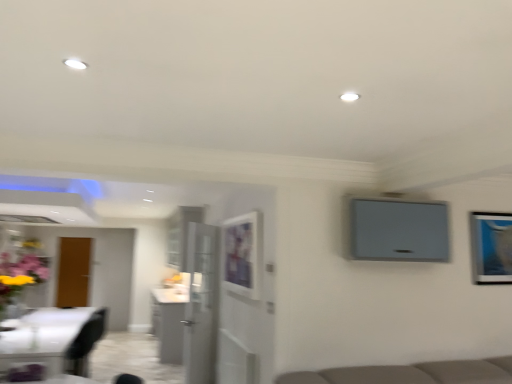
Question: Considering the relative sizes of matte purple vase at left and matte white picture frame at center, acting as the first picture frame starting from the left, in the image provided, is matte purple vase at left shorter than matte white picture frame at center, acting as the first picture frame starting from the left,?

Choices:
 (A) yes
 (B) no

Answer: (A)

Question: Is matte purple vase at left to the left of matte white picture frame at center, acting as the first picture frame starting from the left, from the viewer's perspective?

Choices:
 (A) no
 (B) yes

Answer: (B)

Question: Does matte purple vase at left come in front of matte white picture frame at center, the second picture frame from the right?

Choices:
 (A) yes
 (B) no

Answer: (B)

Question: Is matte purple vase at left thinner than matte white picture frame at center, the second picture frame from the right?

Choices:
 (A) no
 (B) yes

Answer: (A)

Question: Does matte purple vase at left turn towards matte white picture frame at center, the second picture frame from the right?

Choices:
 (A) yes
 (B) no

Answer: (A)

Question: Does matte purple vase at left have a greater height compared to matte white picture frame at center, the second picture frame from the right?

Choices:
 (A) yes
 (B) no

Answer: (B)

Question: Is white glossy cabinet at center wider than matte white picture frame at center, the second picture frame from the right?

Choices:
 (A) no
 (B) yes

Answer: (B)

Question: Does white glossy cabinet at center come behind matte white picture frame at center, the second picture frame from the right?

Choices:
 (A) yes
 (B) no

Answer: (A)

Question: Can we say white glossy cabinet at center lies outside matte white picture frame at center, acting as the first picture frame starting from the left?

Choices:
 (A) yes
 (B) no

Answer: (A)

Question: Is white glossy cabinet at center bigger than matte white picture frame at center, acting as the first picture frame starting from the left?

Choices:
 (A) no
 (B) yes

Answer: (B)

Question: Does white glossy cabinet at center have a smaller size compared to matte white picture frame at center, acting as the first picture frame starting from the left?

Choices:
 (A) yes
 (B) no

Answer: (B)

Question: Does white glossy cabinet at center have a greater height compared to matte white picture frame at center, acting as the first picture frame starting from the left?

Choices:
 (A) yes
 (B) no

Answer: (A)

Question: From the image's perspective, is matte purple vase at left over white glossy cabinet at center?

Choices:
 (A) yes
 (B) no

Answer: (A)